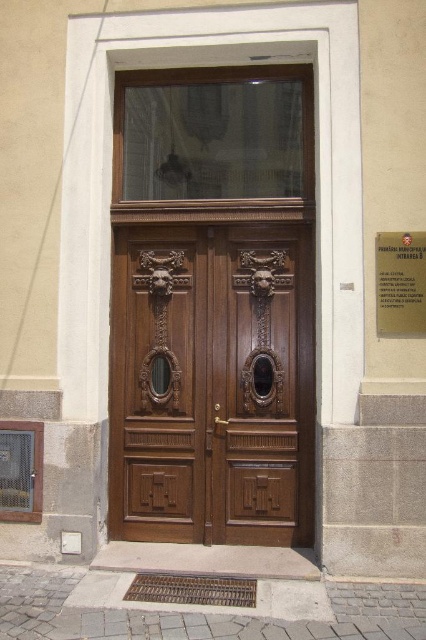
Who is positioned more to the right, polished wood door at center or metallic gold plaque at center?

metallic gold plaque at center is more to the right.

The width and height of the screenshot is (426, 640). I want to click on polished wood door at center, so click(x=212, y=385).